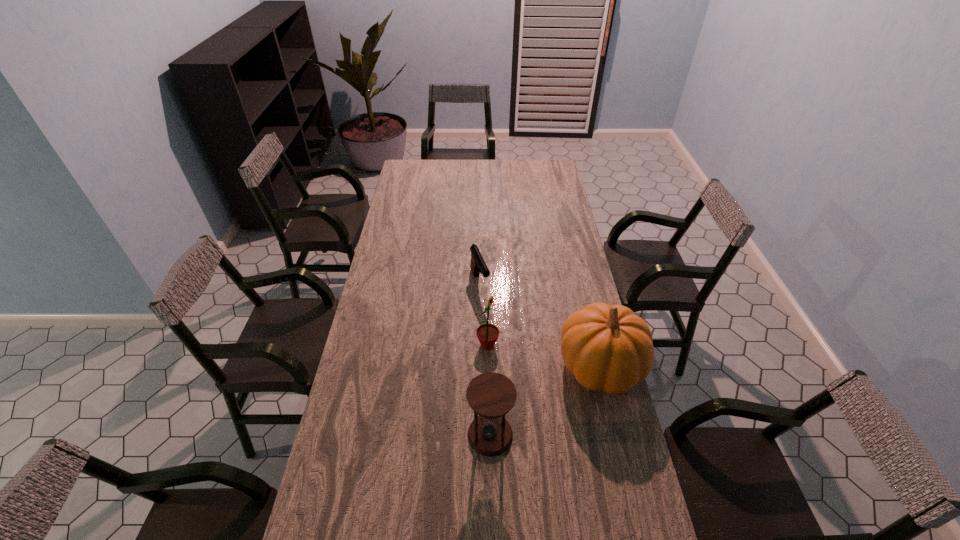
Image resolution: width=960 pixels, height=540 pixels. Find the location of `free region located 0.280m at the barrel of the pistol`. free region located 0.280m at the barrel of the pistol is located at coordinates (506, 349).

I want to click on vacant space situated 0.260m at the barrel of the pistol, so click(504, 346).

Find the location of a particular element. Image resolution: width=960 pixels, height=540 pixels. vacant area situated 0.060m at the barrel of the pistol is located at coordinates (487, 307).

Where is `object at the right edge`? The width and height of the screenshot is (960, 540). object at the right edge is located at coordinates (607, 347).

The image size is (960, 540). I want to click on vacant space at the far edge of the desktop, so click(x=446, y=165).

Where is `vacant region at the near edge`? Image resolution: width=960 pixels, height=540 pixels. vacant region at the near edge is located at coordinates (552, 529).

I want to click on free space at the left edge of the desktop, so click(x=380, y=255).

Find the location of a particular element. This screenshot has width=960, height=540. blank space at the right edge of the desktop is located at coordinates (632, 492).

Find the location of `free area in between the sunflower and the rightmost object`. free area in between the sunflower and the rightmost object is located at coordinates tap(544, 356).

Where is `free space between the pumpkin and the hourglass`? free space between the pumpkin and the hourglass is located at coordinates (545, 401).